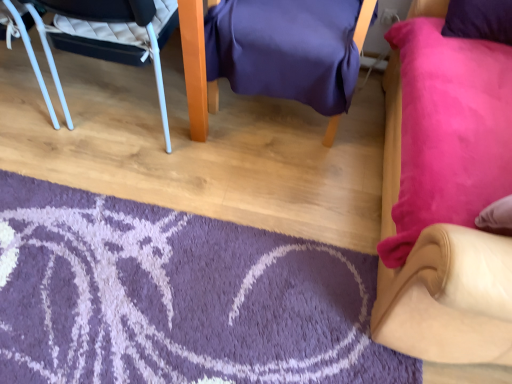
Question: Is white plastic chair at left, which is the 3th chair in right-to-left order, turned away from purple fabric chair at center, which is the 2th chair in right-to-left order?

Choices:
 (A) no
 (B) yes

Answer: (A)

Question: From the image's perspective, is white plastic chair at left, the 1th chair in the left-to-right sequence, located beneath purple fabric chair at center, placed as the second chair when sorted from left to right?

Choices:
 (A) no
 (B) yes

Answer: (B)

Question: From a real-world perspective, is white plastic chair at left, the 1th chair in the left-to-right sequence, on top of purple fabric chair at center, which is the 2th chair in right-to-left order?

Choices:
 (A) yes
 (B) no

Answer: (B)

Question: Is white plastic chair at left, which is the 3th chair in right-to-left order, surrounding purple fabric chair at center, placed as the second chair when sorted from left to right?

Choices:
 (A) yes
 (B) no

Answer: (B)

Question: Does white plastic chair at left, the 1th chair in the left-to-right sequence, have a lesser height compared to purple fabric chair at center, which is the 2th chair in right-to-left order?

Choices:
 (A) no
 (B) yes

Answer: (B)

Question: Is white plastic chair at left, the 1th chair in the left-to-right sequence, directly adjacent to purple fabric chair at center, which is the 2th chair in right-to-left order?

Choices:
 (A) yes
 (B) no

Answer: (B)

Question: Can you confirm if purple shaggy rug at lower left is taller than suede-like beige chair at lower right, the third chair when ordered from left to right?

Choices:
 (A) yes
 (B) no

Answer: (B)

Question: Is purple shaggy rug at lower left not near suede-like beige chair at lower right, the third chair when ordered from left to right?

Choices:
 (A) no
 (B) yes

Answer: (A)

Question: From a real-world perspective, does purple shaggy rug at lower left sit lower than suede-like beige chair at lower right, the third chair when ordered from left to right?

Choices:
 (A) yes
 (B) no

Answer: (A)

Question: Is purple shaggy rug at lower left looking in the opposite direction of suede-like beige chair at lower right, the third chair when ordered from left to right?

Choices:
 (A) no
 (B) yes

Answer: (A)

Question: Is purple shaggy rug at lower left positioned behind suede-like beige chair at lower right, the third chair when ordered from left to right?

Choices:
 (A) no
 (B) yes

Answer: (B)

Question: Is purple shaggy rug at lower left shorter than suede-like beige chair at lower right, the third chair when ordered from left to right?

Choices:
 (A) yes
 (B) no

Answer: (A)

Question: Does purple fabric chair at center, which is the 2th chair in right-to-left order, have a lesser height compared to suede-like beige chair at lower right, the first chair in the right-to-left sequence?

Choices:
 (A) yes
 (B) no

Answer: (A)